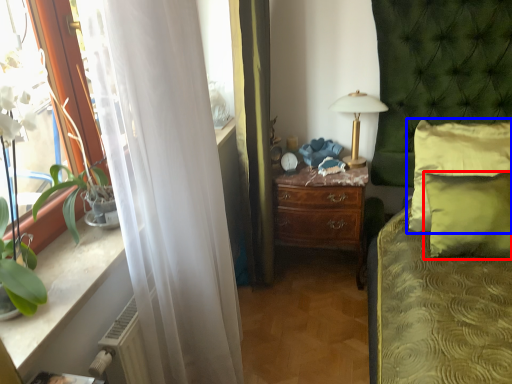
Question: Which object is closer to the camera taking this photo, pillow (highlighted by a red box) or pillow (highlighted by a blue box)?

Choices:
 (A) pillow
 (B) pillow

Answer: (A)